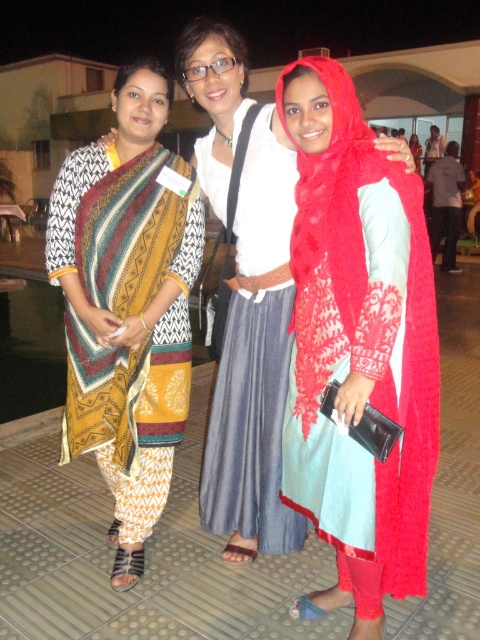
Looking at this image, you are a photographer at the event and want to ensure that both the red lace scarf at center and the printed cotton dress at left are visible in your photo. Given their lengths, which one might you need to adjust your camera angle to better capture?

The red lace scarf at center is shorter than the printed cotton dress at left, so you might need to adjust your camera angle to ensure the shorter red lace scarf at center is properly framed alongside the taller dress.

You are standing at the point labeled point (377, 408) and want to walk towards the point labeled point (142, 531). Which direction should you move to reach your destination?

To reach point (142, 531) from point (377, 408), you should move downward and to the right since point (377, 408) is in front of point (142, 531).

You are a fashion designer observing the women in the image. You need to determine which item of clothing has a narrower width between the red lace scarf at center and the printed cotton dress at left. Which one is narrower?

The red lace scarf at center has a narrower width than the printed cotton dress at left.